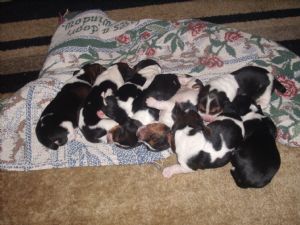
I want to click on green bar design on quilt, so click(x=72, y=44).